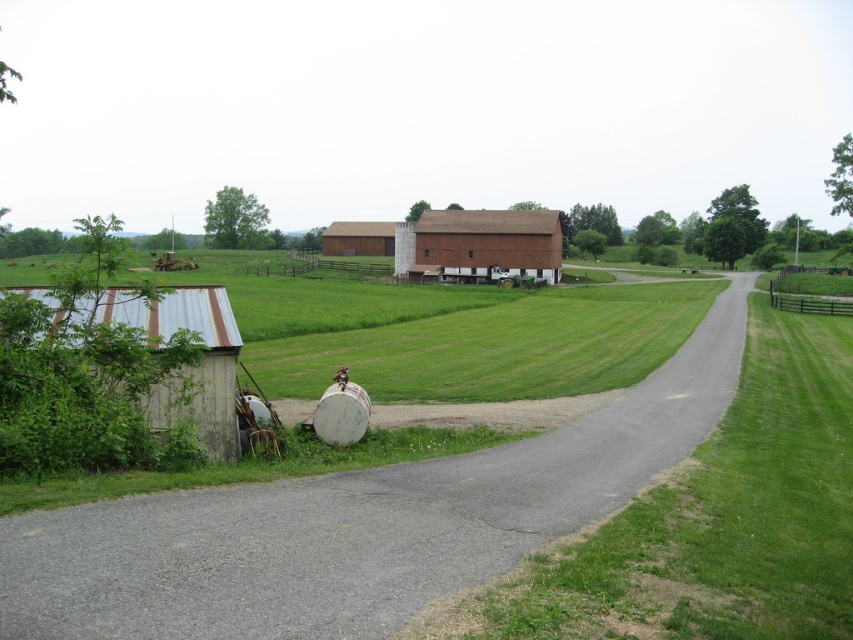
Question: Which object is closer to the camera taking this photo?

Choices:
 (A) rusty corrugated metal shed at lower left
 (B) brown wood barn at center

Answer: (A)

Question: Is rusty corrugated metal shed at lower left below brown wooden barn at center?

Choices:
 (A) yes
 (B) no

Answer: (A)

Question: Which point is closer to the camera?

Choices:
 (A) brown wood barn at center
 (B) gray asphalt road at center

Answer: (B)

Question: Is gray asphalt road at center smaller than rusty corrugated metal shed at lower left?

Choices:
 (A) yes
 (B) no

Answer: (A)

Question: Can you confirm if brown wood barn at center is thinner than brown wooden barn at center?

Choices:
 (A) yes
 (B) no

Answer: (B)

Question: Which of the following is the farthest from the observer?

Choices:
 (A) (335, 228)
 (B) (222, 362)

Answer: (A)